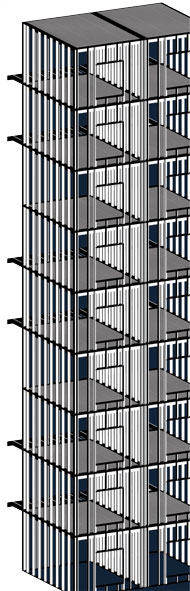
Where is `third floor room`? third floor room is located at coordinates (103, 457), (168, 441).